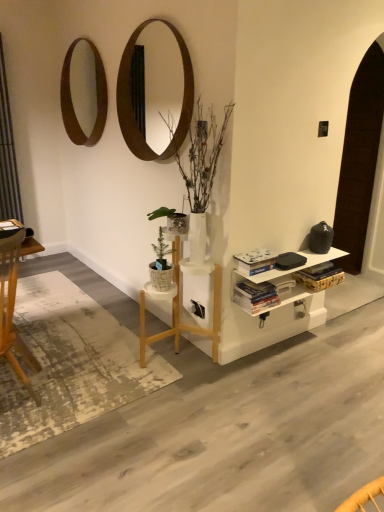
At what (x,y) coordinates should I click in order to perform the action: click on free spot below hardcover book at center, acting as the 1th book starting from the top (from a real-world perspective). Please return your answer as a coordinate pair (x, y). Image resolution: width=384 pixels, height=512 pixels. Looking at the image, I should click on (254, 272).